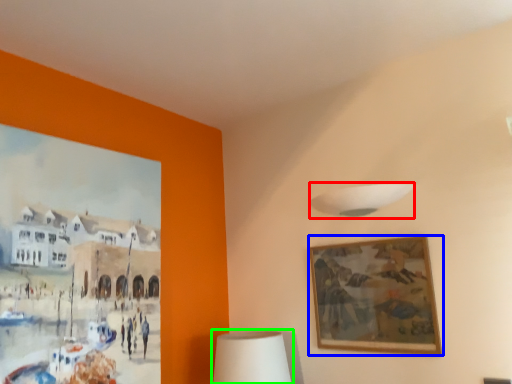
Question: Which object is positioned farthest from lamp (highlighted by a red box)? Select from picture frame (highlighted by a blue box) and table lamp (highlighted by a green box).

Choices:
 (A) picture frame
 (B) table lamp

Answer: (B)